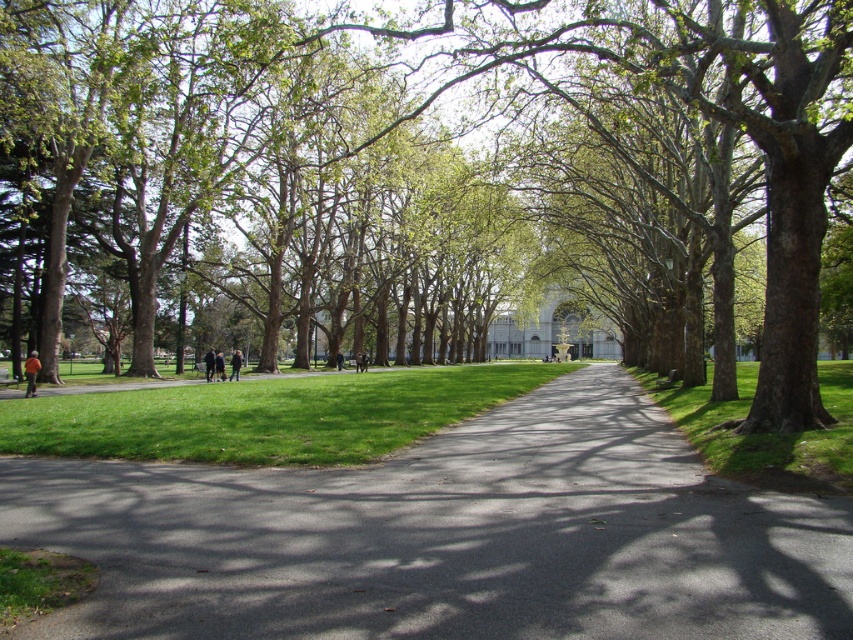
You are standing at the starting point of the pathway in the park. You see two points marked on the pathway. The first point is at coordinates point (x=251, y=492), and the second point is at coordinates point (x=229, y=376). Which point is closer to you as you stand at the starting point?

Point (x=251, y=492) is closer to the viewer than point (x=229, y=376), so the first point is closer to you.

You are standing on the green grass at right and want to walk to the black asphalt road at center. Which direction should you move to reach it?

You should move downward to reach the black asphalt road at center because it is located below the green grass at right.